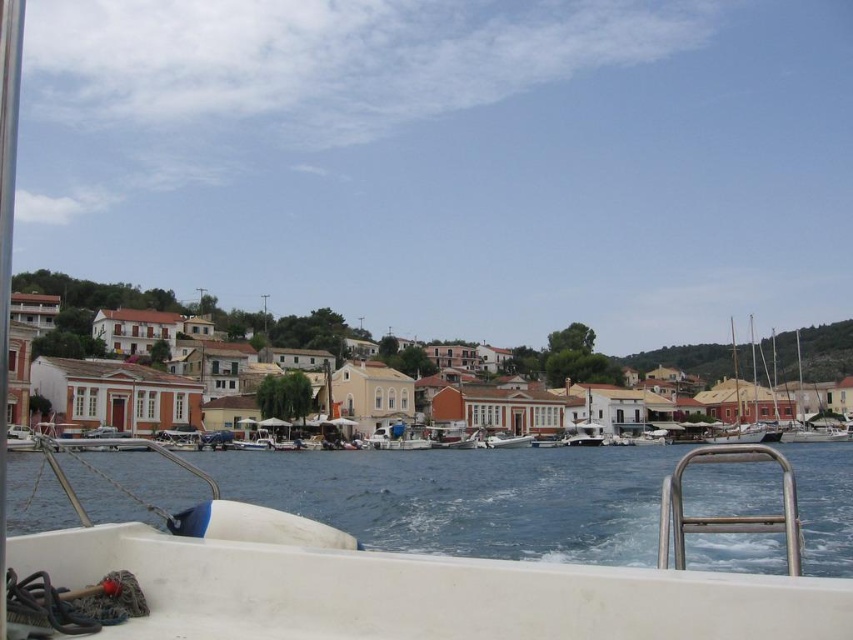
Between blue water at lower center and white matte building at center, which one has less height?

Standing shorter between the two is blue water at lower center.

Find the location of a particular element. blue water at lower center is located at coordinates (467, 497).

Where is `white matte building at center`? white matte building at center is located at coordinates (84, 308).

Is white matte building at center smaller than white matte boat at center?

Actually, white matte building at center might be larger than white matte boat at center.

What do you see at coordinates (84, 308) in the screenshot? I see `white matte building at center` at bounding box center [84, 308].

Locate an element on the screen. This screenshot has height=640, width=853. white matte building at center is located at coordinates (84, 308).

Who is positioned more to the right, blue water at lower center or white matte boat at center?

Positioned to the right is blue water at lower center.

Image resolution: width=853 pixels, height=640 pixels. I want to click on blue water at lower center, so click(467, 497).